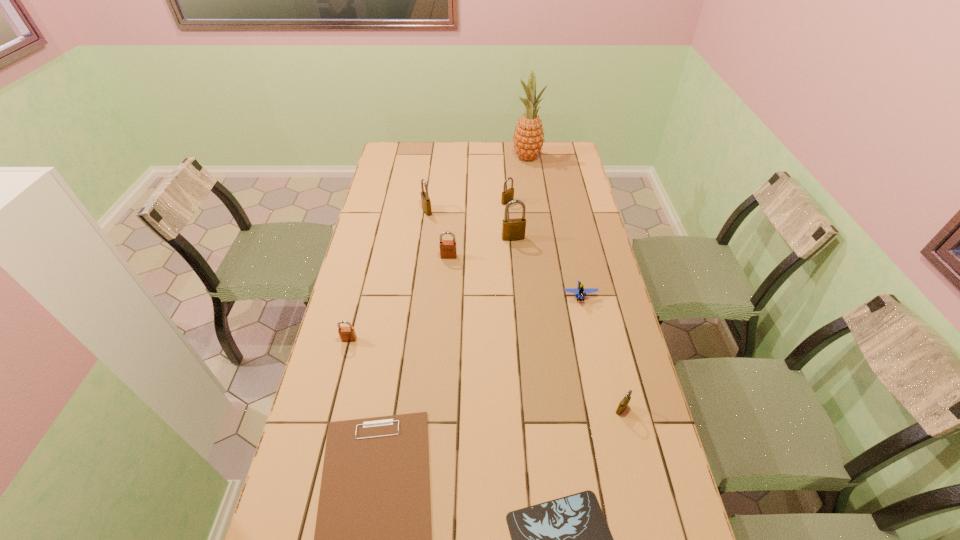
At what (x,y) coordinates should I click in order to perform the action: click on free space located on the back of the ninth nearest object. Please return your answer as a coordinate pair (x, y). Looking at the image, I should click on (505, 164).

You are a GUI agent. You are given a task and a screenshot of the screen. Output one action in this format:
    pyautogui.click(x=<x>, y=<y>)
    Task: Click on the vacant area situated on the left of the nearest brass padlock
    
    Given the screenshot: What is the action you would take?
    pyautogui.click(x=468, y=409)

You are a GUI agent. You are given a task and a screenshot of the screen. Output one action in this format:
    pyautogui.click(x=<x>, y=<y>)
    Task: Click on the free space located on the front-facing side of the nearer brown padlock
    
    Given the screenshot: What is the action you would take?
    pyautogui.click(x=324, y=439)

This screenshot has width=960, height=540. What are the coordinates of `free space located on the front-facing side of the Lego` in the screenshot? It's located at tap(588, 339).

Identify the location of object that is positioned at the far edge. (528, 139).

At what (x,y) coordinates should I click in order to perform the action: click on object located at the left edge. Please return your answer as a coordinate pair (x, y). The image size is (960, 540). Looking at the image, I should click on (347, 334).

Find the location of `pineapple at the right edge`. pineapple at the right edge is located at coordinates (528, 139).

The image size is (960, 540). Find the location of `padlock at the right edge`. padlock at the right edge is located at coordinates (624, 402).

Image resolution: width=960 pixels, height=540 pixels. Identify the location of Lego present at the right edge. (580, 292).

Locate an element on the screen. This screenshot has width=960, height=540. object located at the far right corner is located at coordinates (528, 139).